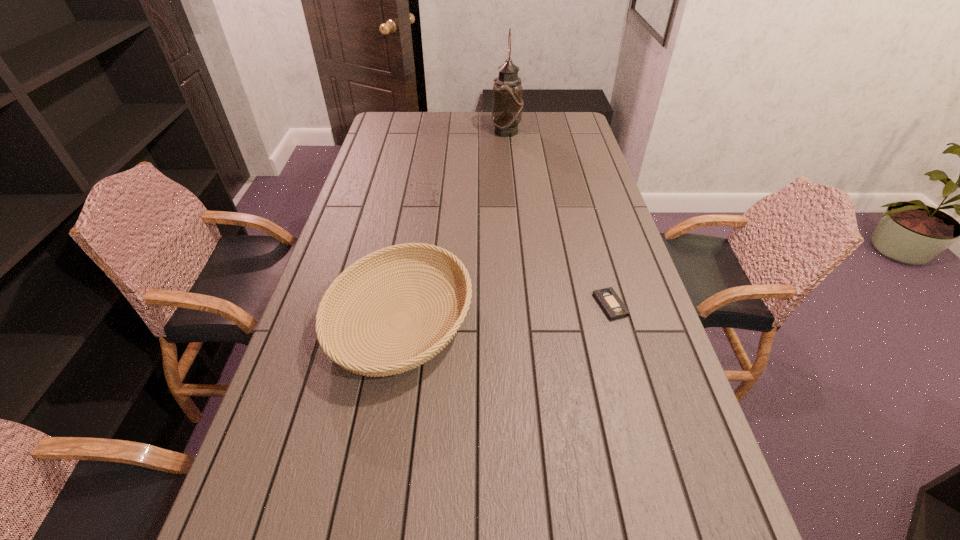
Locate an element on the screen. This screenshot has width=960, height=540. blank area in the image that satisfies the following two spatial constraints: 1. on the temples of the spectacles; 2. on the left side of the videotape is located at coordinates (406, 305).

At what (x,y) coordinates should I click in order to perform the action: click on free location that satisfies the following two spatial constraints: 1. on the temples of the spectacles; 2. on the front side of the basket. Please return your answer as a coordinate pair (x, y). Image resolution: width=960 pixels, height=540 pixels. Looking at the image, I should click on (404, 320).

I want to click on free space that satisfies the following two spatial constraints: 1. on the temples of the shortest object; 2. on the left side of the third nearest object, so click(406, 305).